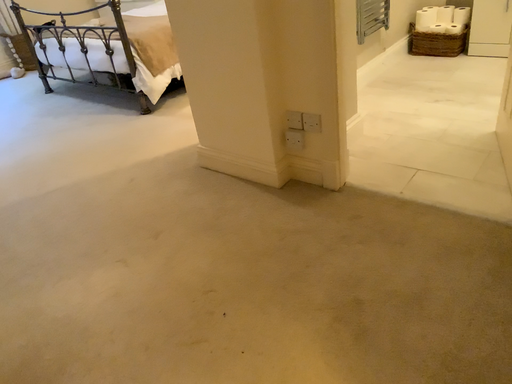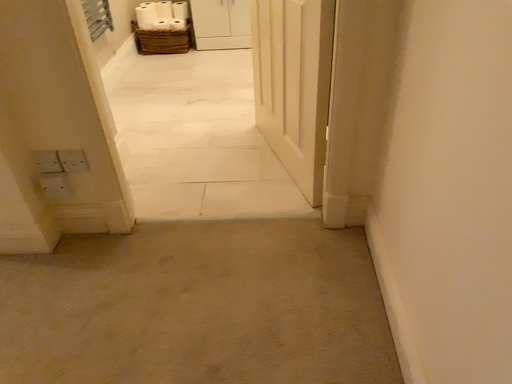
Question: How did the camera likely rotate when shooting the video?

Choices:
 (A) rotated right
 (B) rotated left

Answer: (A)